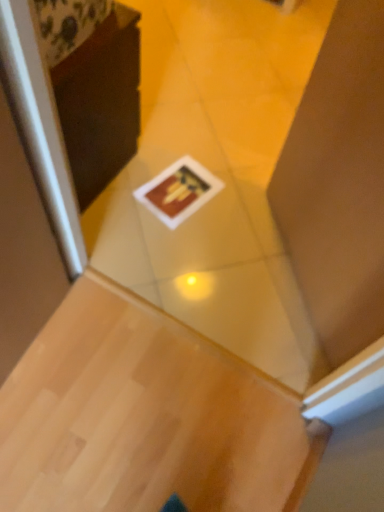
At what (x,y) coordinates should I click in order to perform the action: click on free space in front of wooden drawer at left. Please return your answer as a coordinate pair (x, y). This screenshot has width=384, height=512. Looking at the image, I should click on (110, 217).